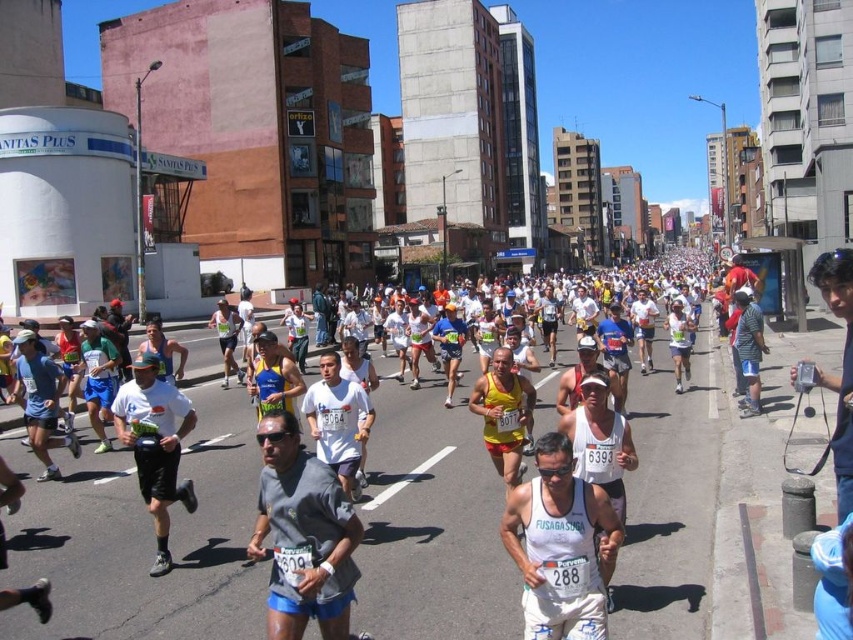
Looking at this image, you are a runner in the marathon and you see two points in the scene. One is at point (524, 579) and the other is at point (500, 429). Which point is closer to you?

Point (524, 579) is closer to the viewer than point (500, 429).

You are a photographer positioned at the starting line of the marathon. You want to capture a photo of the white mesh tank top at center and yellow matte shorts at center such that both are clearly visible. Based on their sizes, is there a risk that one might block the other in the photo?

The white mesh tank top at center might be wider than yellow matte shorts at center, so there is a possibility that the white mesh tank top at center could block the yellow matte shorts at center in the photo if positioned closely.